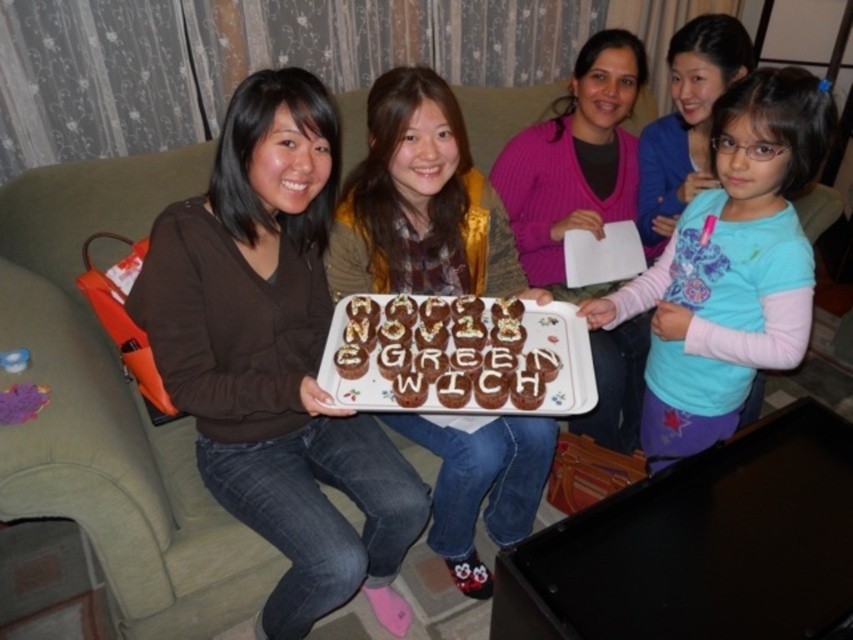
You are standing in the living room and want to give a gift to the person wearing the pink ribbed sweater at center. According to the image, where should you look to find that person?

The person wearing the pink ribbed sweater at center is located at point (575, 161) in the image.

You are taking a photo of the group and want to focus on the point at position (373,488) and the point at position (416,307). Which point should you adjust your focus to first to ensure both are in clear view?

You should focus on point (416,307) first because it is farther from the camera than point (373,488). By focusing on the farther point first, you can adjust the depth of field to include both points clearly.